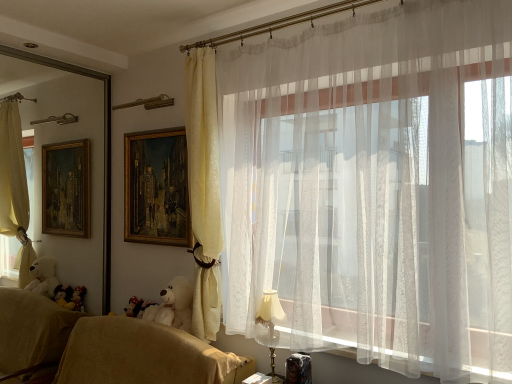
At what (x,y) coordinates should I click in order to perform the action: click on matte yellow curtain at center, which is counted as the second curtain, starting from the right. Please return your answer as a coordinate pair (x, y). Image resolution: width=512 pixels, height=384 pixels. Looking at the image, I should click on (204, 190).

Locate an element on the screen. beige fabric couch at lower left is located at coordinates (144, 355).

Describe the element at coordinates (156, 188) in the screenshot. The image size is (512, 384). I see `gold wooden picture frame at upper center` at that location.

What is the approximate height of white plush toy at lower center?

It is 5.61 inches.

The image size is (512, 384). Describe the element at coordinates (137, 307) in the screenshot. I see `white plush toy at lower center` at that location.

You are a GUI agent. You are given a task and a screenshot of the screen. Output one action in this format:
    pyautogui.click(x=<x>, y=<y>)
    Task: Click on the white plush bear at lower left
    
    Given the screenshot: What is the action you would take?
    pyautogui.click(x=173, y=305)

I want to click on matte yellow curtain at center, the first curtain viewed from the left, so click(x=204, y=190).

Is white plush toy at lower center taller than beige fabric couch at lower left?

No, white plush toy at lower center is not taller than beige fabric couch at lower left.

From a real-world perspective, which object stands above the other?

From a 3D spatial view, white plush toy at lower center is above.

Is white plush toy at lower center positioned with its back to beige fabric couch at lower left?

Yes, white plush toy at lower center is facing away from beige fabric couch at lower left.

Is white plush toy at lower center positioned beyond the bounds of beige fabric couch at lower left?

No, white plush toy at lower center is inside or overlapping with beige fabric couch at lower left.

Measure the distance between white plush toy at lower center and matte yellow curtain at center, which is counted as the second curtain, starting from the right.

white plush toy at lower center and matte yellow curtain at center, which is counted as the second curtain, starting from the right, are 35.19 inches apart.

From the image's perspective, is white plush toy at lower center positioned above or below matte yellow curtain at center, the first curtain viewed from the left?

white plush toy at lower center is situated lower than matte yellow curtain at center, the first curtain viewed from the left, in the image.

Is white plush toy at lower center spatially inside matte yellow curtain at center, the first curtain viewed from the left, or outside of it?

white plush toy at lower center is located beyond the bounds of matte yellow curtain at center, the first curtain viewed from the left.

Locate an element on the screen. Image resolution: width=512 pixels, height=384 pixels. toy to the left of matte yellow curtain at center, the first curtain viewed from the left is located at coordinates (137, 307).

Do you think white plush bear at lower left is within white plush toy at lower center, or outside of it?

white plush bear at lower left is not inside white plush toy at lower center, it's outside.

From a real-world perspective, who is located higher, white plush bear at lower left or white plush toy at lower center?

white plush bear at lower left is physically above.

Does white plush bear at lower left turn towards white plush toy at lower center?

No, white plush bear at lower left is not facing towards white plush toy at lower center.

Between point (184, 314) and point (134, 301), which one is positioned in front?

The point (184, 314) is closer to the camera.

Does beige fabric couch at lower left appear on the left side of white sheer curtain at upper right, which is counted as the 1th curtain, starting from the right?

Yes, beige fabric couch at lower left is to the left of white sheer curtain at upper right, which is counted as the 1th curtain, starting from the right.

Is beige fabric couch at lower left inside the boundaries of white sheer curtain at upper right, which is counted as the 1th curtain, starting from the right, or outside?

beige fabric couch at lower left lies outside white sheer curtain at upper right, which is counted as the 1th curtain, starting from the right.

Considering the relative positions of beige fabric couch at lower left and white sheer curtain at upper right, the 2th curtain from the left, in the image provided, is beige fabric couch at lower left behind white sheer curtain at upper right, the 2th curtain from the left,?

No, beige fabric couch at lower left is closer to the camera.

Is matte gold table lamp at lower right oriented towards white plush toy at lower center?

No, matte gold table lamp at lower right does not turn towards white plush toy at lower center.

Does point (268, 298) come farther from viewer compared to point (138, 300)?

No, (268, 298) is in front of (138, 300).

Can you confirm if matte gold table lamp at lower right is shorter than white plush toy at lower center?

Incorrect, the height of matte gold table lamp at lower right does not fall short of that of white plush toy at lower center.

In terms of width, does matte gold table lamp at lower right look wider or thinner when compared to white plush toy at lower center?

Considering their sizes, matte gold table lamp at lower right looks broader than white plush toy at lower center.

Is white sheer curtain at upper right, the 2th curtain from the left, at the back of white plush bear at lower left?

No, white sheer curtain at upper right, the 2th curtain from the left, is not at the back of white plush bear at lower left.

In the image, is white plush bear at lower left positioned in front of or behind white sheer curtain at upper right, which is counted as the 1th curtain, starting from the right?

In the image, white plush bear at lower left appears behind white sheer curtain at upper right, which is counted as the 1th curtain, starting from the right.

Can you tell me how much white plush bear at lower left and white sheer curtain at upper right, which is counted as the 1th curtain, starting from the right, differ in facing direction?

There is a 4-degree angle between the facing directions of white plush bear at lower left and white sheer curtain at upper right, which is counted as the 1th curtain, starting from the right.

Is white plush bear at lower left at the left side of white sheer curtain at upper right, which is counted as the 1th curtain, starting from the right?

Yes.

Looking at their sizes, would you say gold wooden picture frame at upper center is wider or thinner than white plush bear at lower left?

Considering their sizes, gold wooden picture frame at upper center looks slimmer than white plush bear at lower left.

Which is in front, point (157, 210) or point (179, 299)?

The point (179, 299) is closer.

Is gold wooden picture frame at upper center positioned with its back to white plush bear at lower left?

No, gold wooden picture frame at upper center's orientation is not away from white plush bear at lower left.

Relative to white plush bear at lower left, is gold wooden picture frame at upper center in front or behind?

gold wooden picture frame at upper center is behind white plush bear at lower left.

This screenshot has height=384, width=512. Identify the location of furniture on the left side of white plush toy at lower center. (144, 355).

Locate an element on the screen. toy located behind the matte yellow curtain at center, which is counted as the second curtain, starting from the right is located at coordinates (137, 307).

Estimate the real-world distances between objects in this image. Which object is further from white sheer curtain at upper right, the 2th curtain from the left, white plush toy at lower center or white plush bear at lower left?

white plush toy at lower center is further to white sheer curtain at upper right, the 2th curtain from the left.

When comparing their distances from white plush toy at lower center, does matte yellow curtain at center, the first curtain viewed from the left, or gold wooden picture frame at upper center seem further?

matte yellow curtain at center, the first curtain viewed from the left, is positioned further to the anchor white plush toy at lower center.

Which object lies nearer to the anchor point matte gold table lamp at lower right, white sheer curtain at upper right, the 2th curtain from the left, or white plush bear at lower left?

white plush bear at lower left is closer to matte gold table lamp at lower right.

When comparing their distances from matte gold table lamp at lower right, does matte yellow curtain at center, which is counted as the second curtain, starting from the right, or white plush toy at lower center seem closer?

The object closer to matte gold table lamp at lower right is matte yellow curtain at center, which is counted as the second curtain, starting from the right.

Looking at the image, which one is located closer to gold wooden picture frame at upper center, white sheer curtain at upper right, which is counted as the 1th curtain, starting from the right, or beige fabric couch at lower left?

beige fabric couch at lower left is positioned closer to the anchor gold wooden picture frame at upper center.

Estimate the real-world distances between objects in this image. Which object is further from beige fabric couch at lower left, white plush toy at lower center or white sheer curtain at upper right, the 2th curtain from the left?

The object further to beige fabric couch at lower left is white sheer curtain at upper right, the 2th curtain from the left.

From the image, which object appears to be nearer to beige fabric couch at lower left, white plush toy at lower center or matte yellow curtain at center, which is counted as the second curtain, starting from the right?

The object closer to beige fabric couch at lower left is white plush toy at lower center.

When comparing their distances from gold wooden picture frame at upper center, does matte yellow curtain at center, which is counted as the second curtain, starting from the right, or white plush toy at lower center seem closer?

matte yellow curtain at center, which is counted as the second curtain, starting from the right.

Where is `animal between white sheer curtain at upper right, which is counted as the 1th curtain, starting from the right, and white plush toy at lower center in the front-back direction`? Image resolution: width=512 pixels, height=384 pixels. animal between white sheer curtain at upper right, which is counted as the 1th curtain, starting from the right, and white plush toy at lower center in the front-back direction is located at coordinates (173, 305).

Where is `animal between gold wooden picture frame at upper center and white plush toy at lower center in the up-down direction`? This screenshot has height=384, width=512. animal between gold wooden picture frame at upper center and white plush toy at lower center in the up-down direction is located at coordinates (173, 305).

At what (x,y) coordinates should I click in order to perform the action: click on table lamp located between white sheer curtain at upper right, the 2th curtain from the left, and white plush bear at lower left in the depth direction. Please return your answer as a coordinate pair (x, y). The image size is (512, 384). Looking at the image, I should click on (270, 328).

The height and width of the screenshot is (384, 512). Identify the location of curtain between white sheer curtain at upper right, which is counted as the 1th curtain, starting from the right, and gold wooden picture frame at upper center, along the z-axis. (204, 190).